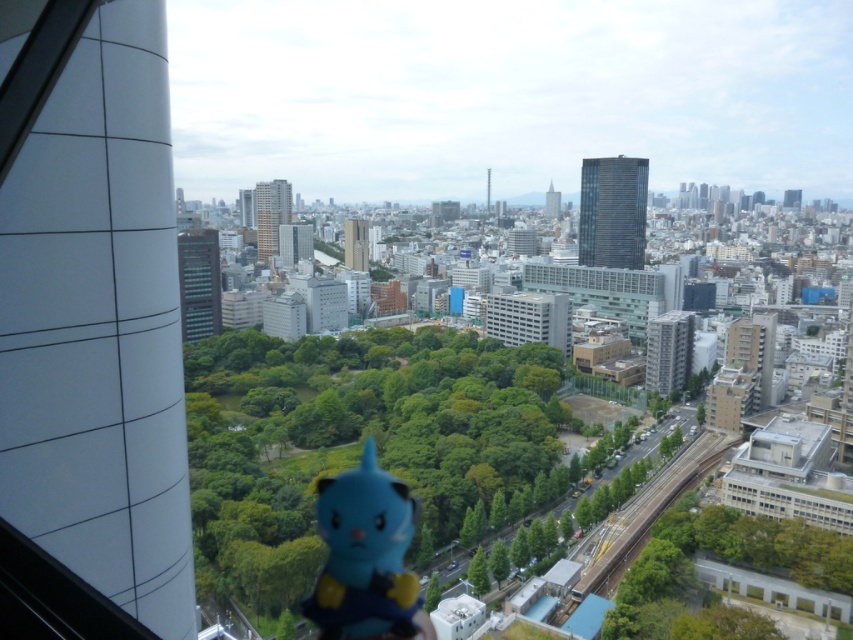
Question: Which of the following is the farthest from the observer?

Choices:
 (A) transparent plastic window at lower right
 (B) green leafy tree at lower right

Answer: (A)

Question: Which point is farther to the camera?

Choices:
 (A) green leafy tree at lower right
 (B) transparent glass window at lower right

Answer: (B)

Question: Considering the relative positions of transparent plastic window at lower right and transparent glass window at center in the image provided, where is transparent plastic window at lower right located with respect to transparent glass window at center?

Choices:
 (A) left
 (B) right

Answer: (A)

Question: Can you confirm if green leafy trees at center is positioned below transparent glass window at lower right?

Choices:
 (A) no
 (B) yes

Answer: (A)

Question: Does transparent glass window at center have a smaller size compared to transparent glass window at lower right?

Choices:
 (A) yes
 (B) no

Answer: (B)

Question: Which point is farther to the camera?

Choices:
 (A) (779, 605)
 (B) (708, 550)
 (C) (756, 595)

Answer: (B)